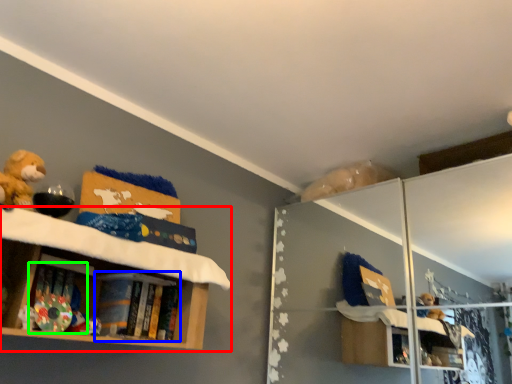
Question: Considering the real-world distances, which object is farthest from shelf (highlighted by a red box)? book (highlighted by a blue box) or book (highlighted by a green box)?

Choices:
 (A) book
 (B) book

Answer: (B)